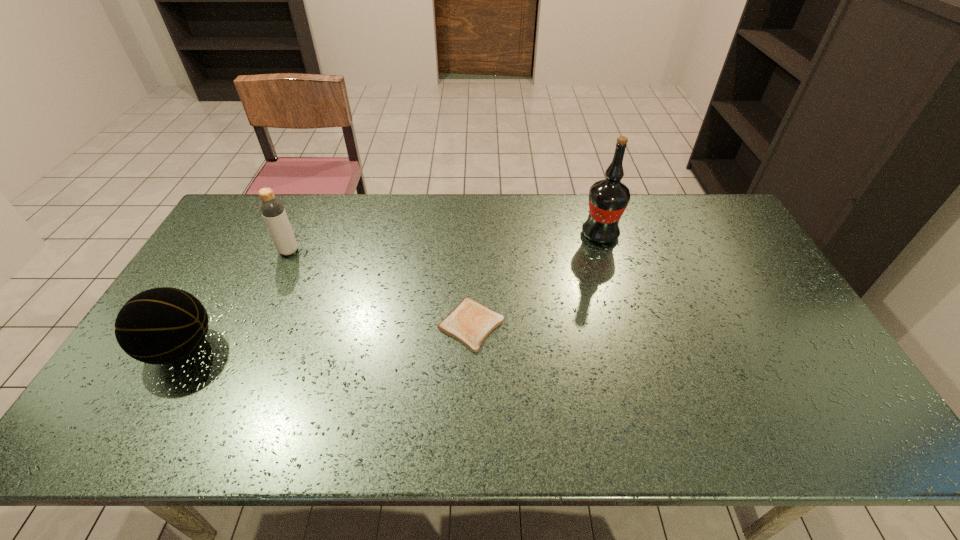
Where is `blank space located on the right of the leftmost object`? This screenshot has height=540, width=960. blank space located on the right of the leftmost object is located at coordinates (365, 348).

The height and width of the screenshot is (540, 960). What are the coordinates of `vacant region located 0.050m on the front of the shortest object` in the screenshot? It's located at pos(470,368).

At what (x,y) coordinates should I click in order to perform the action: click on object located at the far edge. Please return your answer as a coordinate pair (x, y). This screenshot has width=960, height=540. Looking at the image, I should click on (608, 198).

This screenshot has width=960, height=540. Identify the location of object that is at the left edge. (163, 325).

Locate an element on the screen. This screenshot has height=540, width=960. free space at the far edge is located at coordinates 645,205.

Image resolution: width=960 pixels, height=540 pixels. What are the coordinates of `free region at the near edge of the desktop` in the screenshot? It's located at (165, 425).

At what (x,y) coordinates should I click in order to perform the action: click on blank space at the left edge. Please return your answer as a coordinate pair (x, y). Looking at the image, I should click on (230, 253).

At what (x,y) coordinates should I click in order to perform the action: click on vacant space at the right edge. Please return your answer as a coordinate pair (x, y). Image resolution: width=960 pixels, height=540 pixels. Looking at the image, I should click on point(803,367).

In the image, there is a desktop. Where is `free space at the near left corner`? free space at the near left corner is located at coordinates (156, 436).

Image resolution: width=960 pixels, height=540 pixels. In the image, there is a desktop. Find the location of `blank space at the far right corner`. blank space at the far right corner is located at coordinates (717, 235).